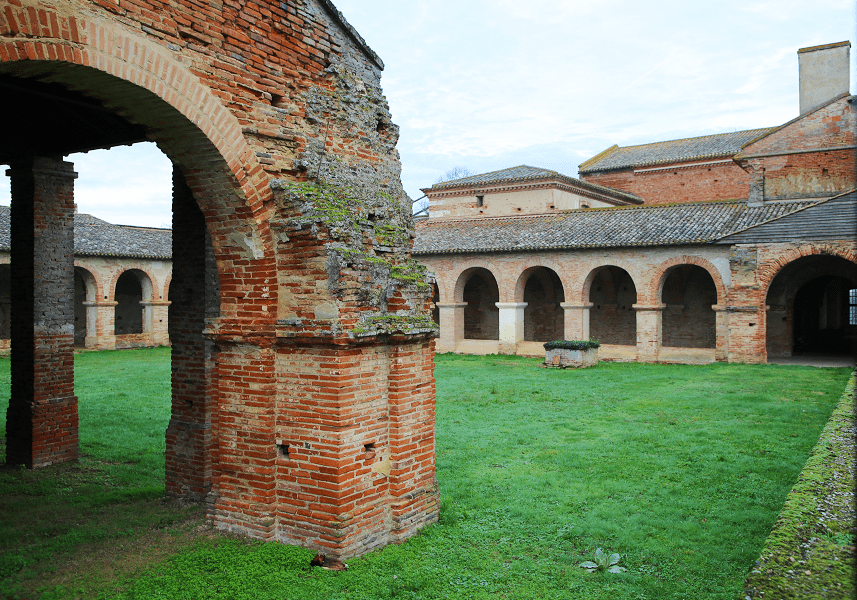
Image resolution: width=857 pixels, height=600 pixels. Identify the location of upstairs window. (478, 197).